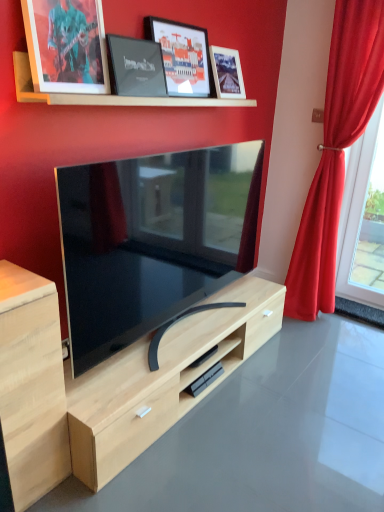
Locate an element on the screen. vacant space underneath red velvet curtain at right (from a real-world perspective) is located at coordinates (333, 320).